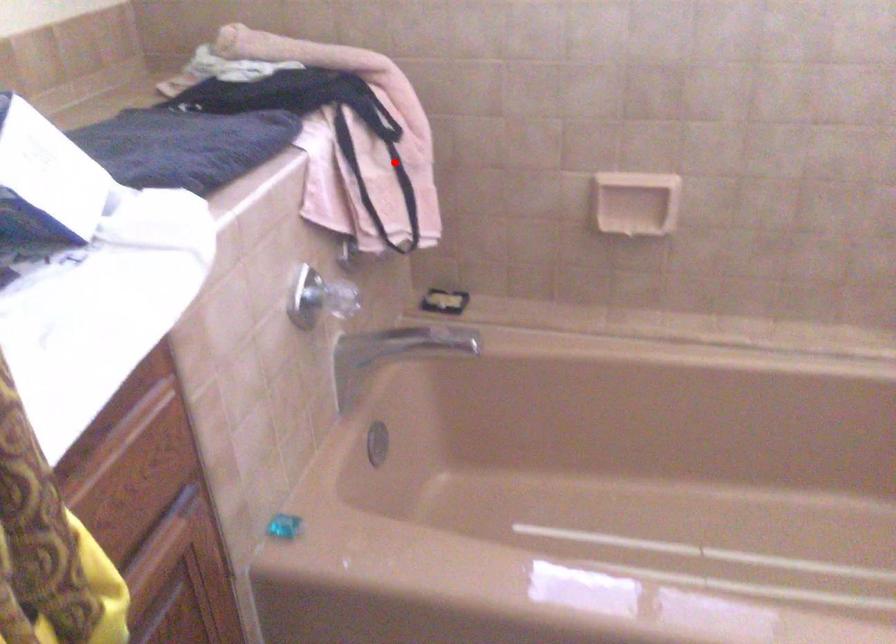
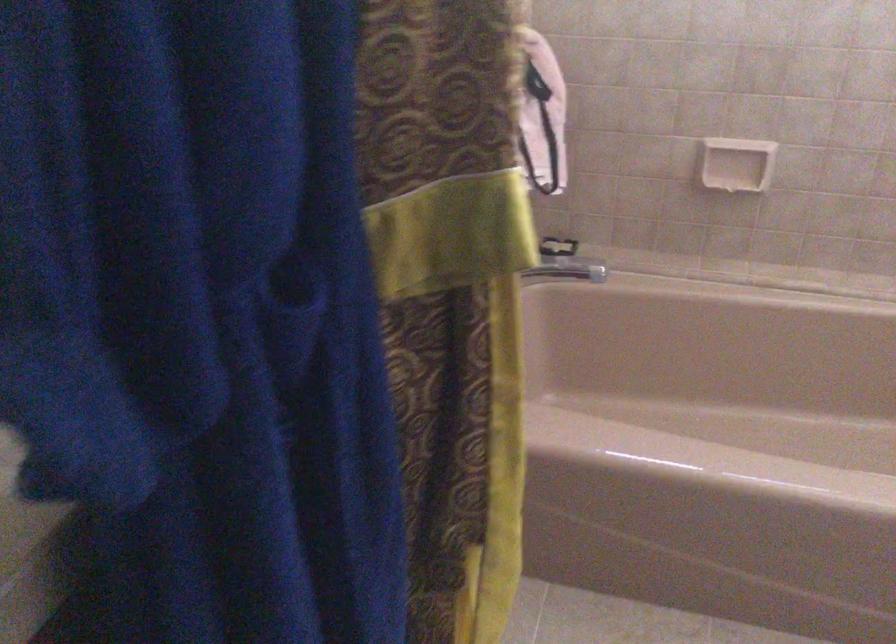
Locate, in the second image, the point that corresponds to the highlighted location in the first image.

(540, 116)